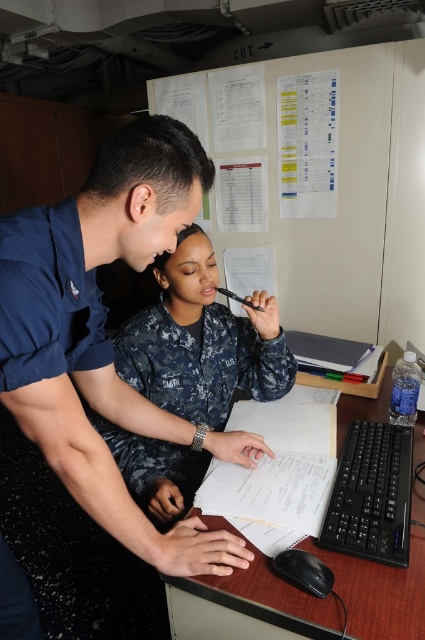
Is point (156, 314) more distant than point (360, 586)?

Yes, it is behind point (360, 586).

Who is taller, dull blue uniform at center or white paper at center?

Standing taller between the two is dull blue uniform at center.

Is point (268, 380) farther from camera compared to point (422, 589)?

Yes, point (268, 380) is farther from viewer.

This screenshot has height=640, width=425. I want to click on dull blue uniform at center, so click(x=201, y=340).

Does blue uniform at center have a lesser height compared to dull blue uniform at center?

No, blue uniform at center is not shorter than dull blue uniform at center.

Between blue uniform at center and dull blue uniform at center, which one appears on the right side from the viewer's perspective?

dull blue uniform at center

This screenshot has width=425, height=640. Identify the location of blue uniform at center. (104, 333).

Identify the location of blue uniform at center. (104, 333).

Does blue uniform at center lie behind white paper at center?

No, it is not.

Does point (93, 461) come farther from viewer compared to point (214, 604)?

That is False.

Does point (11, 221) come behind point (254, 611)?

No, it is in front of (254, 611).

At what (x,y) coordinates should I click in order to perform the action: click on blue uniform at center. Please return your answer as a coordinate pair (x, y). This screenshot has height=640, width=425. Looking at the image, I should click on (104, 333).